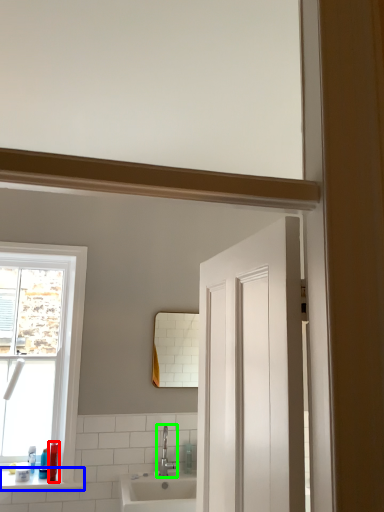
Question: Which object is the farthest from toiletry (highlighted by a red box)? Choose among these: window sill (highlighted by a blue box) or tap (highlighted by a green box).

Choices:
 (A) window sill
 (B) tap

Answer: (B)